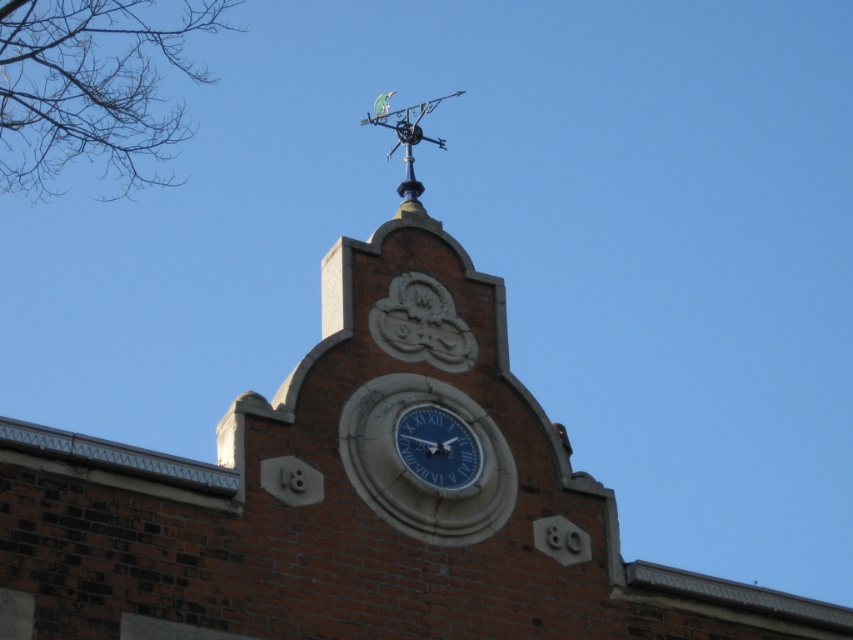
Is blue glossy clock at center above metallic green vane at upper center?

Incorrect, blue glossy clock at center is not positioned above metallic green vane at upper center.

Which of these two, blue glossy clock at center or metallic green vane at upper center, stands shorter?

With less height is blue glossy clock at center.

Which is behind, point (469, 472) or point (372, 120)?

The point (372, 120) is behind.

Find the location of `blue glossy clock at center`. blue glossy clock at center is located at coordinates (437, 445).